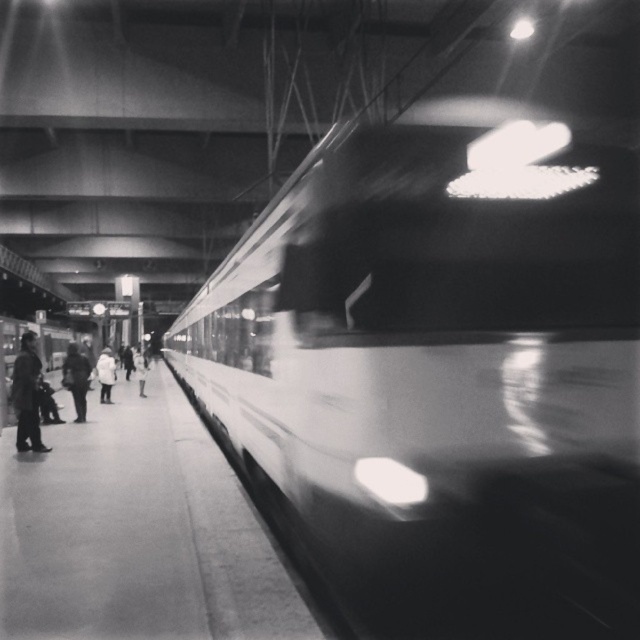
Describe the element at coordinates (28, 396) in the screenshot. I see `dark wool coat at left` at that location.

Between point (26, 387) and point (81, 416), which one is positioned behind?

The point (81, 416) is more distant.

Between point (24, 424) and point (68, 380), which one is positioned in front?

Point (24, 424) is in front.

Locate an element on the screen. dark wool coat at left is located at coordinates pos(28,396).

Between smooth white train at right and white matte coat at lower left, which one appears on the left side from the viewer's perspective?

white matte coat at lower left is more to the left.

Is smooth white train at right wider than white matte coat at lower left?

Yes.

Find the location of a particular element. smooth white train at right is located at coordinates (428, 323).

Locate an element on the screen. smooth white train at right is located at coordinates (428, 323).

Which is behind, point (396, 300) or point (80, 376)?

Positioned behind is point (80, 376).

Is point (404, 465) positioned after point (80, 401)?

No.

The width and height of the screenshot is (640, 640). I want to click on smooth white train at right, so click(x=428, y=323).